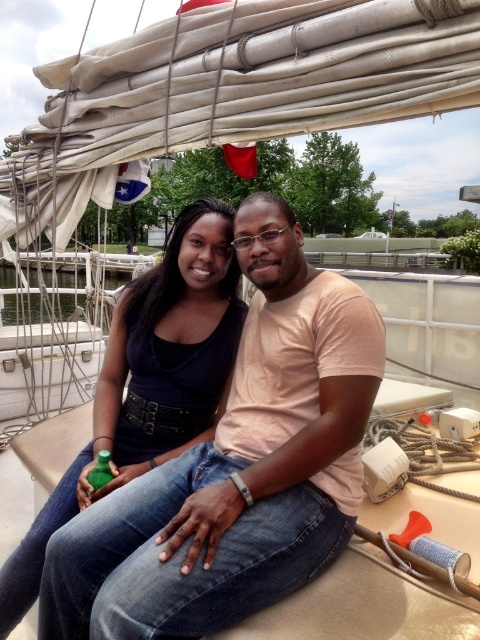
Is matte black tank top at center smaller than green matte bottle at lower left?

No.

Which is below, matte black tank top at center or green matte bottle at lower left?

green matte bottle at lower left

Is point (156, 454) closer to camera compared to point (103, 483)?

No, (156, 454) is behind (103, 483).

Image resolution: width=480 pixels, height=640 pixels. In order to click on matte black tank top at center in this screenshot , I will do tap(148, 380).